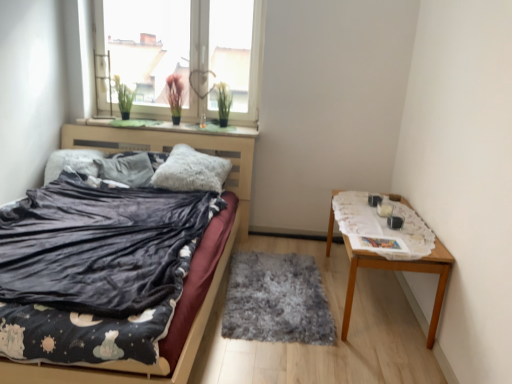
Question: In the image, is transparent glass window at upper center on the left side or the right side of white lace tablecloth at right?

Choices:
 (A) left
 (B) right

Answer: (A)

Question: From the image's perspective, relative to white lace tablecloth at right, is transparent glass window at upper center above or below?

Choices:
 (A) below
 (B) above

Answer: (B)

Question: Which object is positioned farthest from the green felt at upper center?

Choices:
 (A) transparent glass window at upper center
 (B) fluffy gray pillow at center, arranged as the 1th pillow when viewed from the left
 (C) fluffy gray pillow at center, which is counted as the first pillow, starting from the right
 (D) wooden table at right
 (E) white lace tablecloth at right

Answer: (D)

Question: Considering the real-world distances, which object is farthest from the velvet dark blue bed at center?

Choices:
 (A) green felt at upper center
 (B) fuzzy gray rug at center
 (C) fluffy gray pillow at center, acting as the 2th pillow starting from the left
 (D) transparent glass window at upper center
 (E) white lace tablecloth at right

Answer: (D)